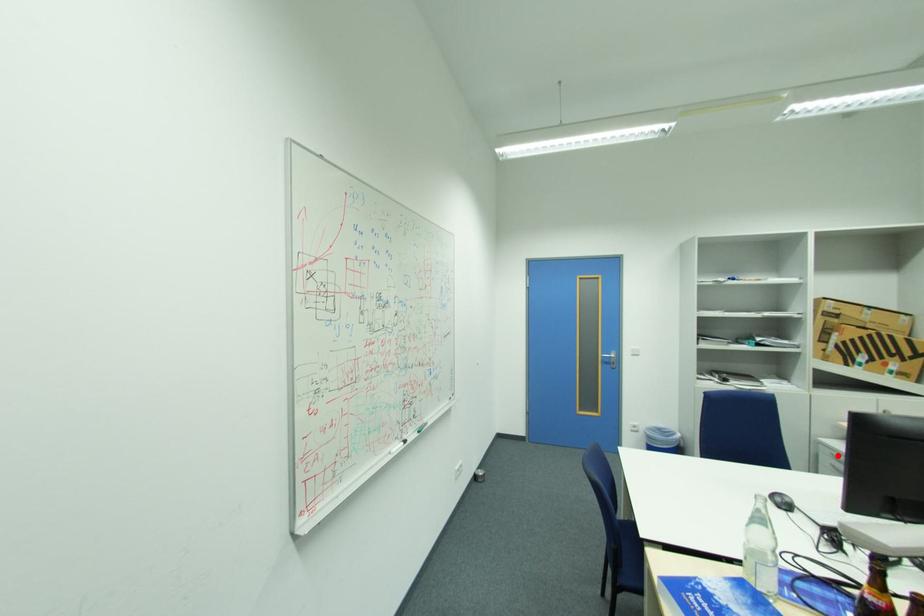
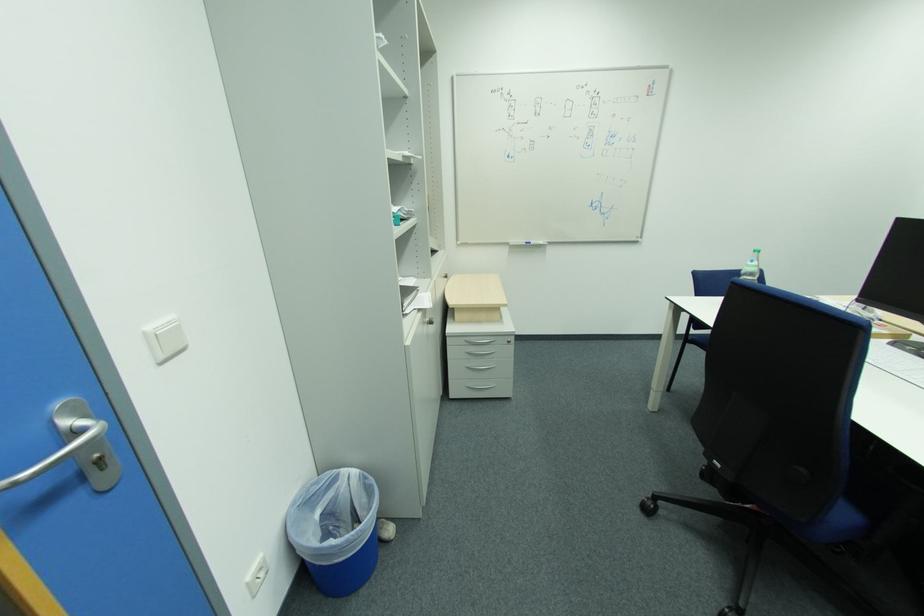
Locate, in the second image, the point that corresponds to the highlighted location in the first image.

(471, 342)